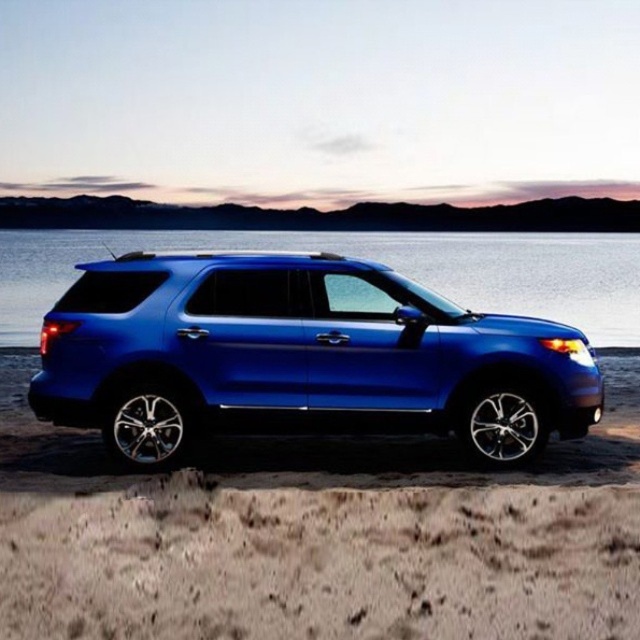
Question: Is metallic blue suv at center smaller than blue metallic water at center?

Choices:
 (A) yes
 (B) no

Answer: (A)

Question: Which of the following is the closest to the observer?

Choices:
 (A) (305, 396)
 (B) (404, 248)
 (C) (212, 589)

Answer: (C)

Question: Can you confirm if sandy beige at lower center is bigger than blue metallic water at center?

Choices:
 (A) no
 (B) yes

Answer: (A)

Question: Which object is the farthest from the metallic blue suv at center?

Choices:
 (A) sandy beige at lower center
 (B) blue metallic water at center

Answer: (B)

Question: Which of the following is the farthest from the observer?

Choices:
 (A) (512, 385)
 (B) (522, 541)

Answer: (A)

Question: Observing the image, what is the correct spatial positioning of sandy beige at lower center in reference to blue metallic water at center?

Choices:
 (A) below
 (B) above

Answer: (A)